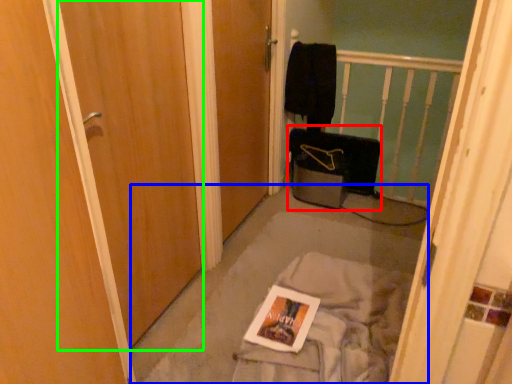
Question: Which object is the farthest from luggage (highlighted by a red box)? Choose among these: concrete (highlighted by a blue box) or door (highlighted by a green box).

Choices:
 (A) concrete
 (B) door

Answer: (B)